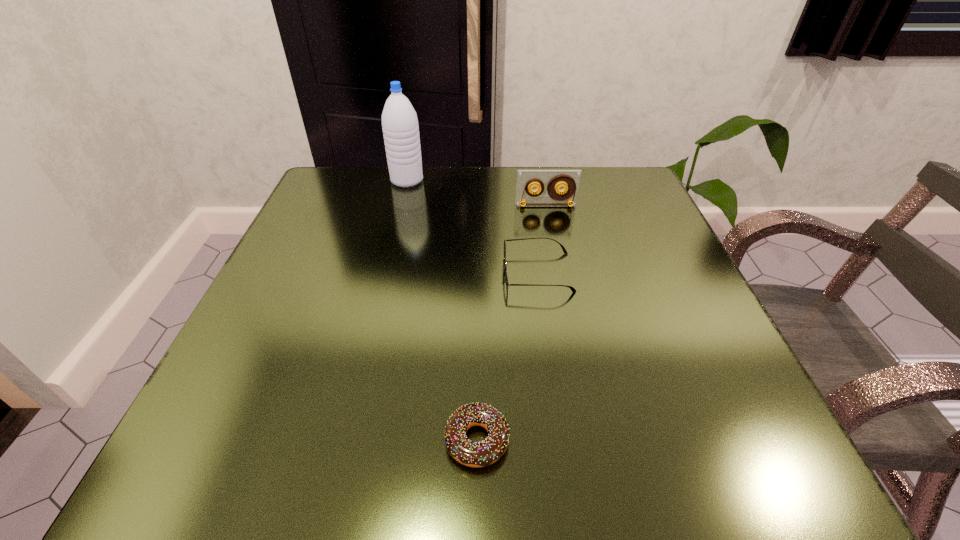
Find the location of `water bottle`. water bottle is located at coordinates (400, 127).

Where is `the tallest object`? Image resolution: width=960 pixels, height=540 pixels. the tallest object is located at coordinates (400, 127).

Image resolution: width=960 pixels, height=540 pixels. Find the location of `the second tallest object`. the second tallest object is located at coordinates (526, 179).

You are a GUI agent. You are given a task and a screenshot of the screen. Output one action in this format:
    pyautogui.click(x=<x>, y=<y>)
    Task: Click on the videotape
    Image resolution: width=960 pixels, height=540 pixels.
    Given the screenshot: What is the action you would take?
    point(526,179)

Where is `spectacles`? Image resolution: width=960 pixels, height=540 pixels. spectacles is located at coordinates (564, 250).

The width and height of the screenshot is (960, 540). Identify the location of doughnut. (472, 454).

Locate an element on the screen. The width and height of the screenshot is (960, 540). the second object from left to right is located at coordinates (472, 454).

What are the coordinates of `free space located 0.150m on the front of the tallest object` in the screenshot? It's located at [x=396, y=226].

At what (x,y) coordinates should I click in order to perform the action: click on blank space located at the front of the videotape with visible reels. Please return your answer as a coordinate pair (x, y). The image size is (960, 540). Looking at the image, I should click on (561, 280).

This screenshot has height=540, width=960. In order to click on vacant space located 0.320m on the front-facing side of the spectacles in this screenshot , I will do `click(330, 272)`.